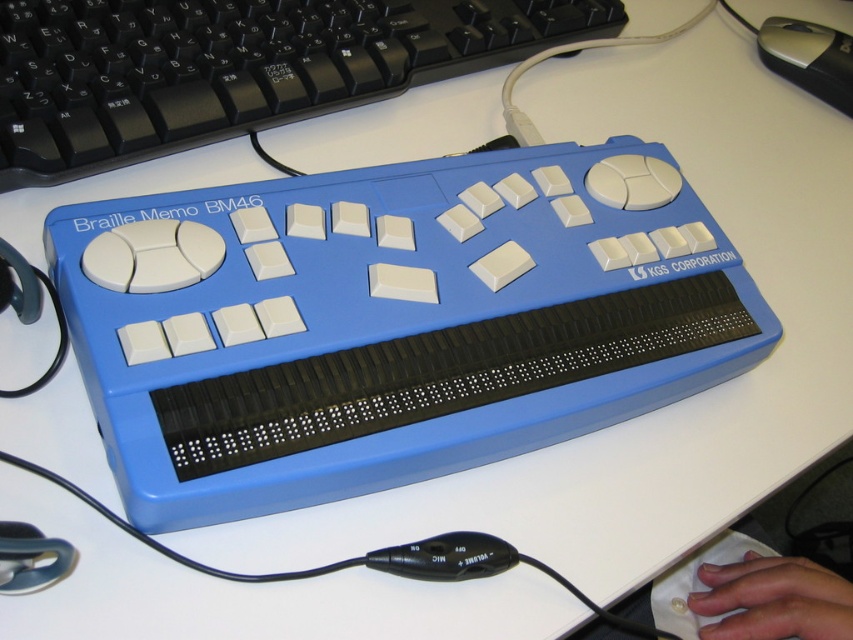
You are a visually impaired user trying to locate your input devices. Which object is nearer to you between the blue plastic keyboard at upper center and the silver metallic mouse at upper right?

The blue plastic keyboard at upper center is closer to the viewer than the silver metallic mouse at upper right, so the blue plastic keyboard at upper center is nearer to you.

You are setting up a workstation for a visually impaired user. You have a blue plastic keyboard at upper center and a silver metallic mouse at upper right. The user needs to place their hands on both devices simultaneously. Can they reach both devices if their hands can extend 18 inches apart?

The blue plastic keyboard at upper center is 17.26 inches from the silver metallic mouse at upper right. Since the user can extend their hands 18 inches apart, they can comfortably reach both devices.

You are using the Braille Memo BM46 device and need to locate two points on its surface. The points are labeled as point (77, 28) and point (778, 58). Which point is closer to you when you are facing the device?

Point (77, 28) is closer to the viewer than point (778, 58).